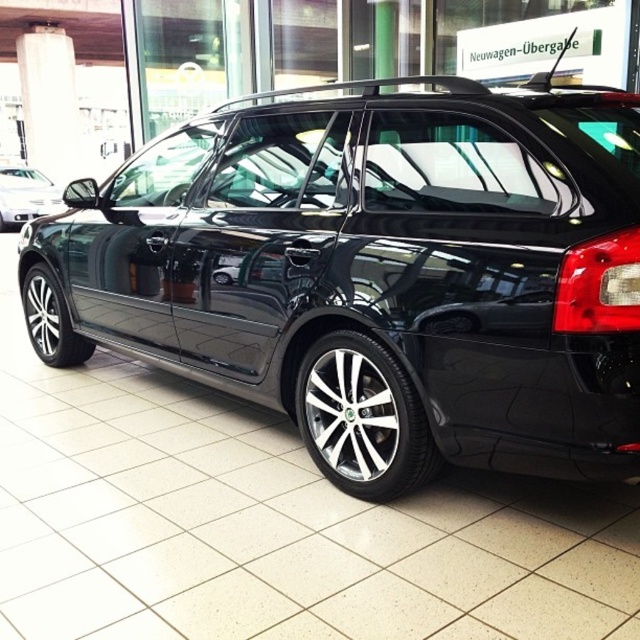
You are a customer at the car dealership and want to take a closer look at both cars. Starting from the entrance, which car should you approach first to see the glossy black car at center and the matte black car at left in order?

Since the glossy black car at center is in front of the matte black car at left, you should first approach the glossy black car at center before moving to the matte black car at left to see both in order.

Based on the photo, you are a customer at the car dealership and want to know which car is bigger between the glossy black car at center and the matte black car at left. Can you tell me?

The glossy black car at center is larger than the matte black car at left.

You are standing at the entrance of the car dealership showroom and see two points marked on the floor. The first point is at coordinate point (496, 138) and the second point is at coordinate point (26, 179). Which point is closer to the entrance?

Point (496, 138) is in front of point (26, 179), so it is closer to the entrance.